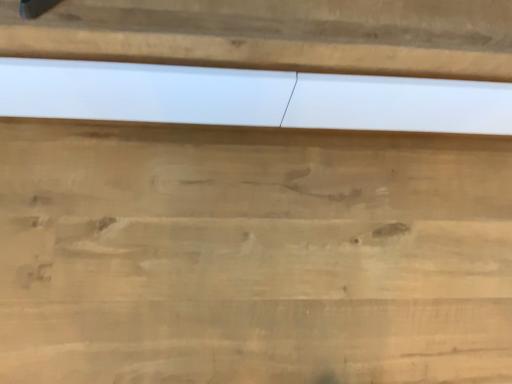
Question: Is white matte panel at center not close to natural wood cutting board at center?

Choices:
 (A) yes
 (B) no

Answer: (B)

Question: Could natural wood cutting board at center be considered to be inside white matte panel at center?

Choices:
 (A) yes
 (B) no

Answer: (B)

Question: Can you confirm if white matte panel at center is thinner than natural wood cutting board at center?

Choices:
 (A) yes
 (B) no

Answer: (A)

Question: Considering the relative positions of white matte panel at center and natural wood cutting board at center in the image provided, is white matte panel at center behind natural wood cutting board at center?

Choices:
 (A) yes
 (B) no

Answer: (B)

Question: Is white matte panel at center to the right of natural wood cutting board at center from the viewer's perspective?

Choices:
 (A) yes
 (B) no

Answer: (A)

Question: Is white matte panel at center aimed at natural wood cutting board at center?

Choices:
 (A) no
 (B) yes

Answer: (B)

Question: Considering the relative positions of natural wood cutting board at center and white matte panel at center in the image provided, is natural wood cutting board at center in front of white matte panel at center?

Choices:
 (A) yes
 (B) no

Answer: (B)

Question: From the image's perspective, is natural wood cutting board at center on top of white matte panel at center?

Choices:
 (A) no
 (B) yes

Answer: (A)

Question: Is natural wood cutting board at center directly adjacent to white matte panel at center?

Choices:
 (A) no
 (B) yes

Answer: (A)

Question: Is white matte panel at center surrounded by natural wood cutting board at center?

Choices:
 (A) no
 (B) yes

Answer: (A)

Question: Is natural wood cutting board at center at the left side of white matte panel at center?

Choices:
 (A) yes
 (B) no

Answer: (A)

Question: Are natural wood cutting board at center and white matte panel at center far apart?

Choices:
 (A) yes
 (B) no

Answer: (B)

Question: In terms of width, does white matte panel at center look wider or thinner when compared to natural wood cutting board at center?

Choices:
 (A) wide
 (B) thin

Answer: (B)